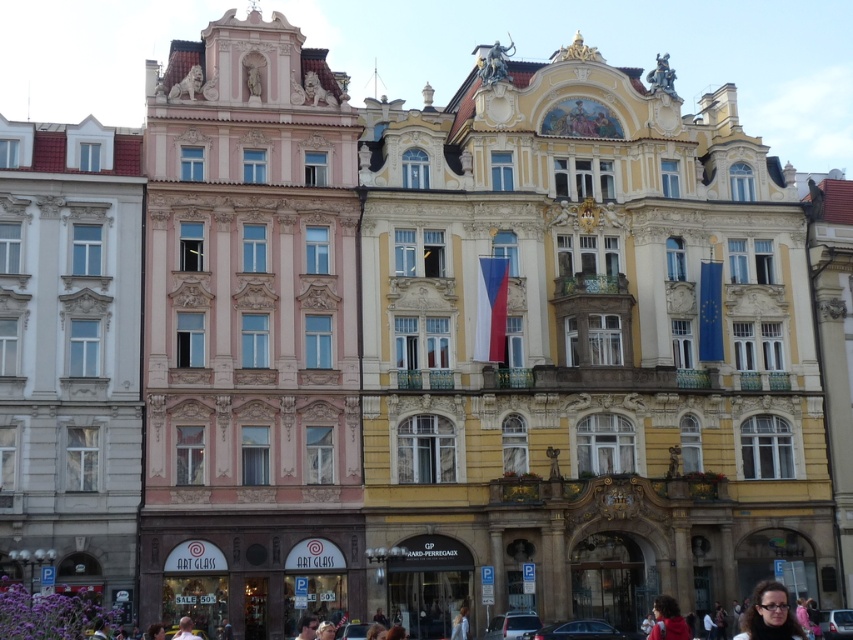
Question: Observing the image, what is the correct spatial positioning of white stone building at left in reference to dark brown hair at lower center?

Choices:
 (A) above
 (B) below

Answer: (A)

Question: Can you confirm if yellow stone building at center is positioned to the left of matte black hair at lower right?

Choices:
 (A) no
 (B) yes

Answer: (B)

Question: Which of the following is the farthest from the observer?

Choices:
 (A) light brown hair at lower center
 (B) pink stucco building at center
 (C) matte black hair at lower right
 (D) white stone building at left

Answer: (B)

Question: Among these objects, which one is nearest to the camera?

Choices:
 (A) white stone building at left
 (B) blue fabric flag at center

Answer: (A)

Question: Considering the real-world distances, which object is farthest from the blue fabric flag at center?

Choices:
 (A) pink stucco building at center
 (B) blue and white striped fabric at center

Answer: (A)

Question: Is blue and white striped fabric at center bigger than blue fabric flag at center?

Choices:
 (A) yes
 (B) no

Answer: (A)